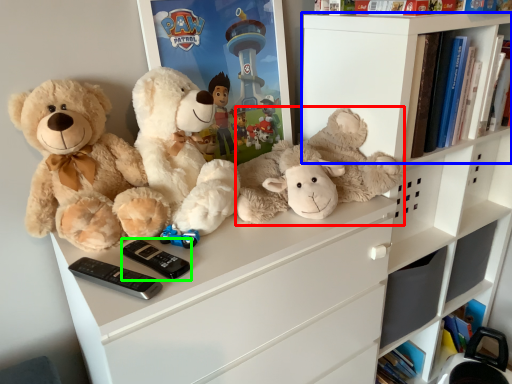
Question: Estimate the real-world distances between objects in this image. Which object is farther from teddy bear (highlighted by a red box), shelf (highlighted by a blue box) or control (highlighted by a green box)?

Choices:
 (A) shelf
 (B) control

Answer: (B)